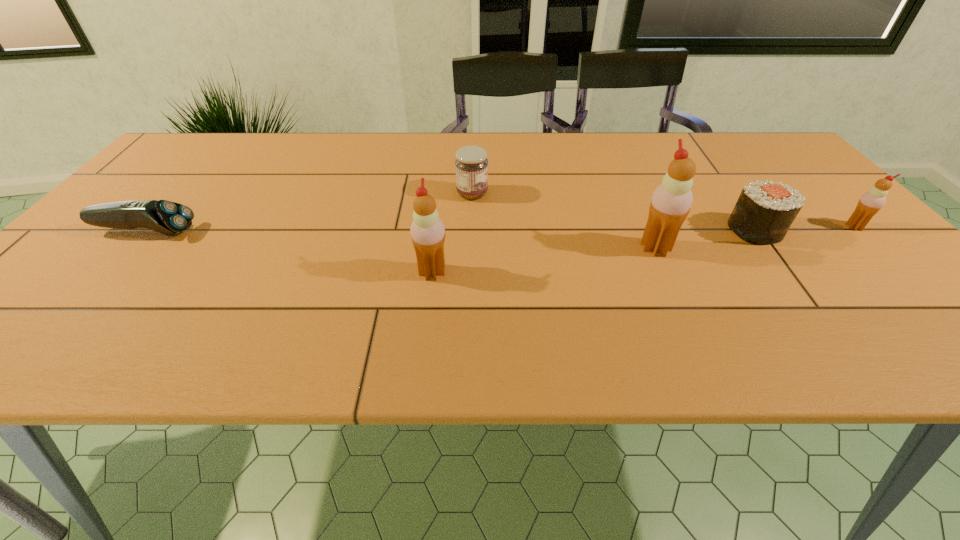
Please point out where to position a new icecream on the left to maintain spacing. Please provide its 2D coordinates. Your answer should be formatted as a tuple, i.e. [(x, y)], where the tuple contains the x and y coordinates of a point satisfying the conditions above.

[(180, 299)]